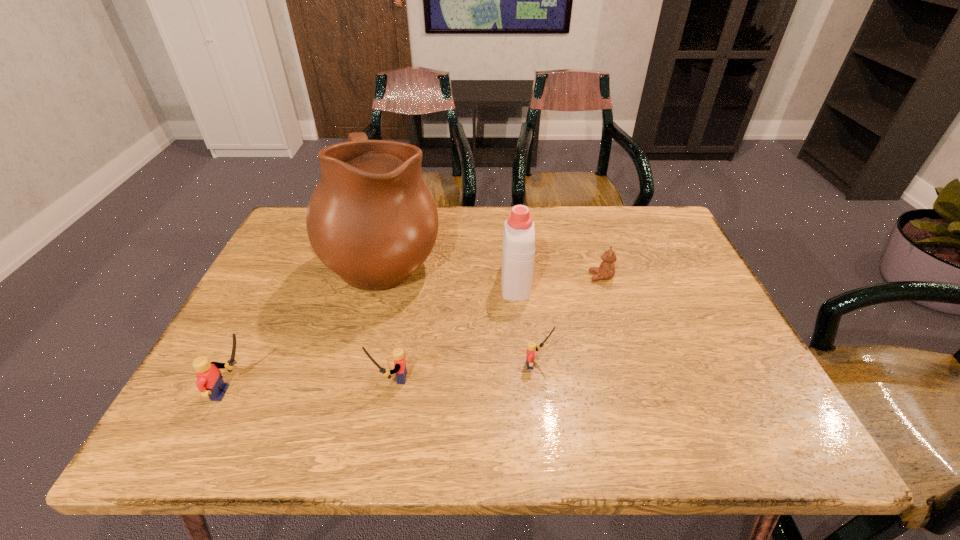
Locate an element on the screen. The height and width of the screenshot is (540, 960). the second closest Lego to the fourth shortest object is located at coordinates click(531, 346).

Locate an element on the screen. the closest Lego to the leftmost object is located at coordinates (400, 370).

Find the location of a particular element. The image size is (960, 540). vacant space that satisfies the following two spatial constraints: 1. at the spout of the tallest object; 2. on the handle side of the second tallest object is located at coordinates (379, 281).

Locate an element on the screen. This screenshot has height=540, width=960. free region that satisfies the following two spatial constraints: 1. on the handle side of the detergent; 2. at the spout of the cream pitcher is located at coordinates (513, 257).